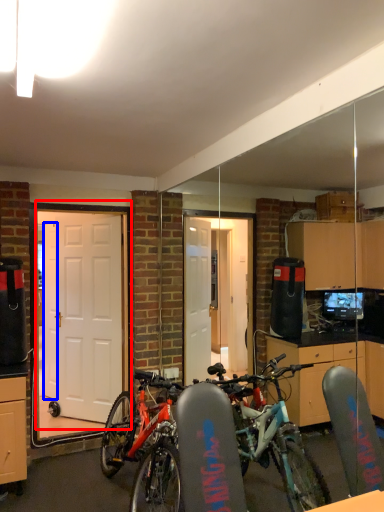
Question: Which of the following is the farthest to the observer, door (highlighted by a red box) or door (highlighted by a blue box)?

Choices:
 (A) door
 (B) door

Answer: (B)